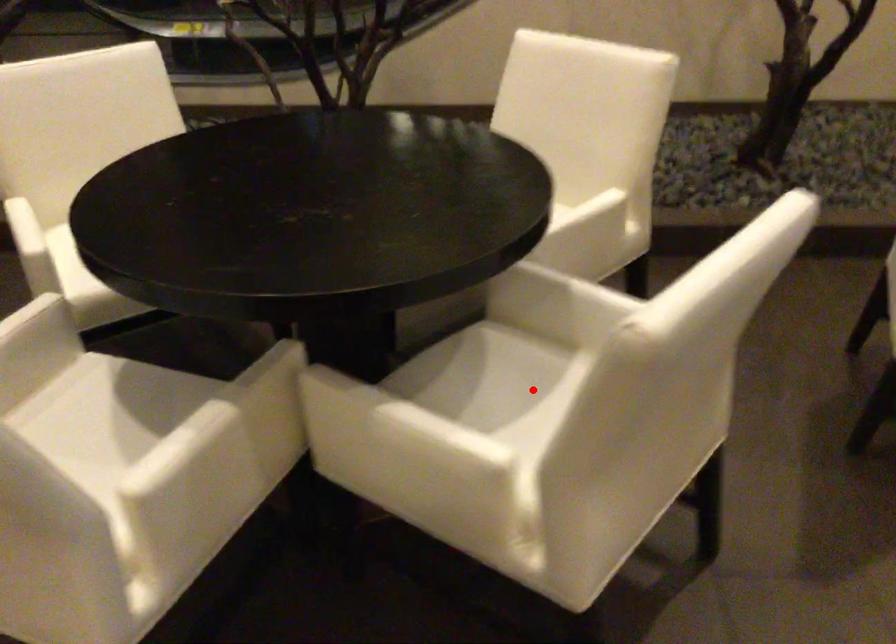
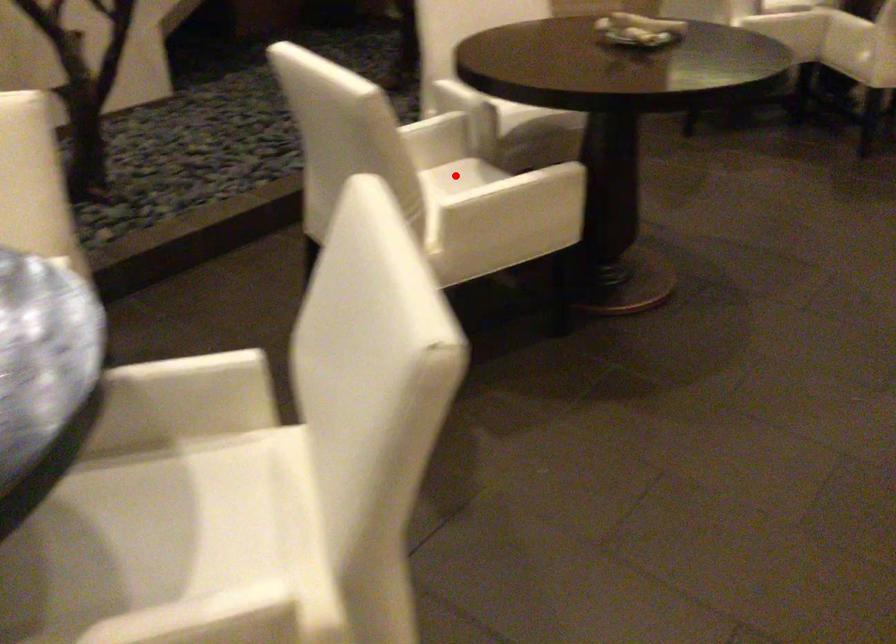
I am providing you with two images of the same scene from different viewpoints. A red point is marked on the first image and another point is marked on the second image. Is the marked point in image1 the same physical position as the marked point in image2?

No